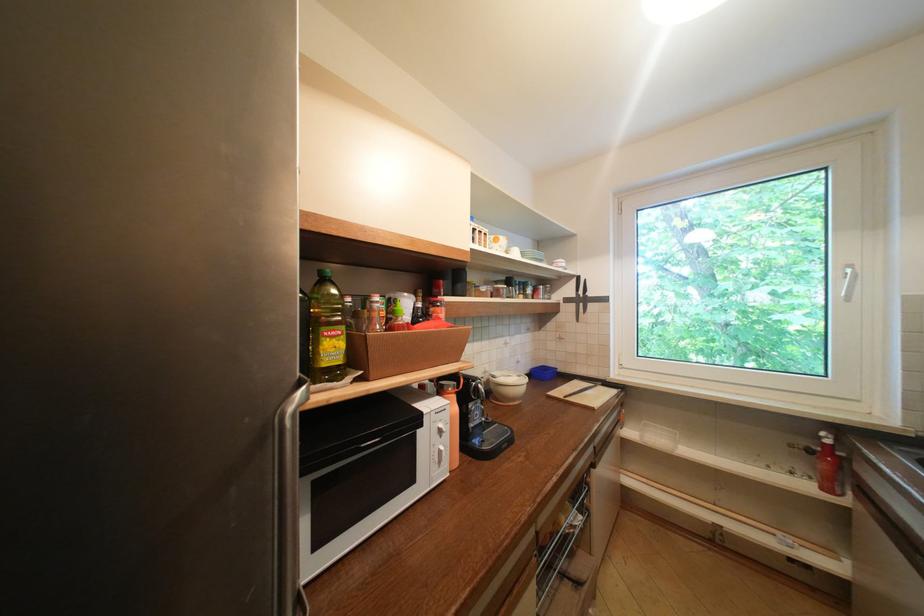
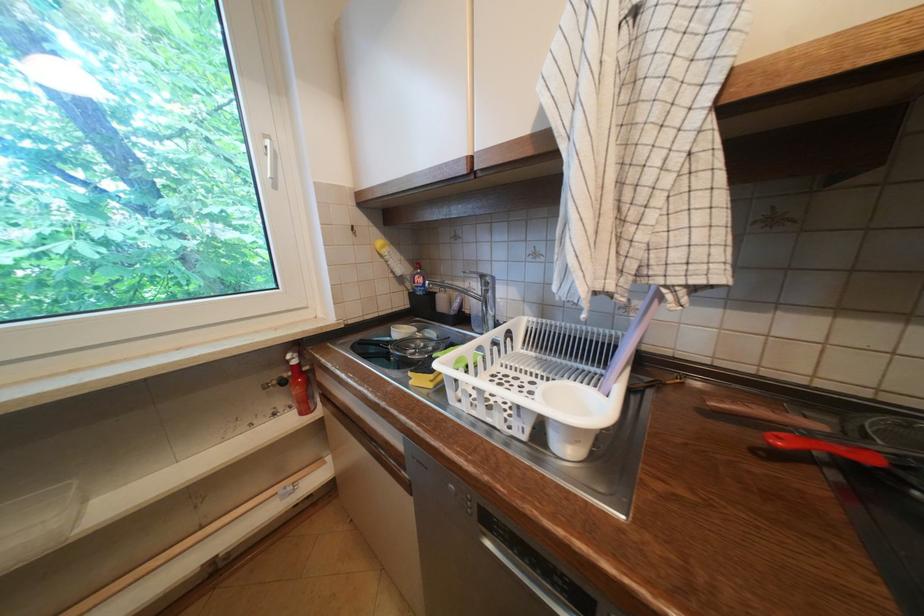
Question: The images are taken continuously from a first-person perspective. In which direction is your viewpoint rotating?

Choices:
 (A) Left
 (B) Right
 (C) Up
 (D) Down

Answer: (B)